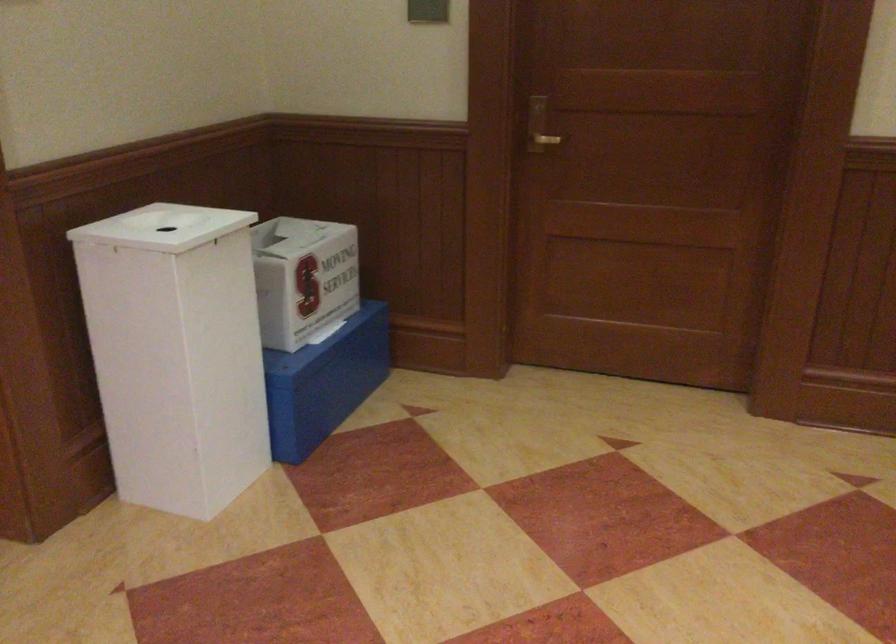
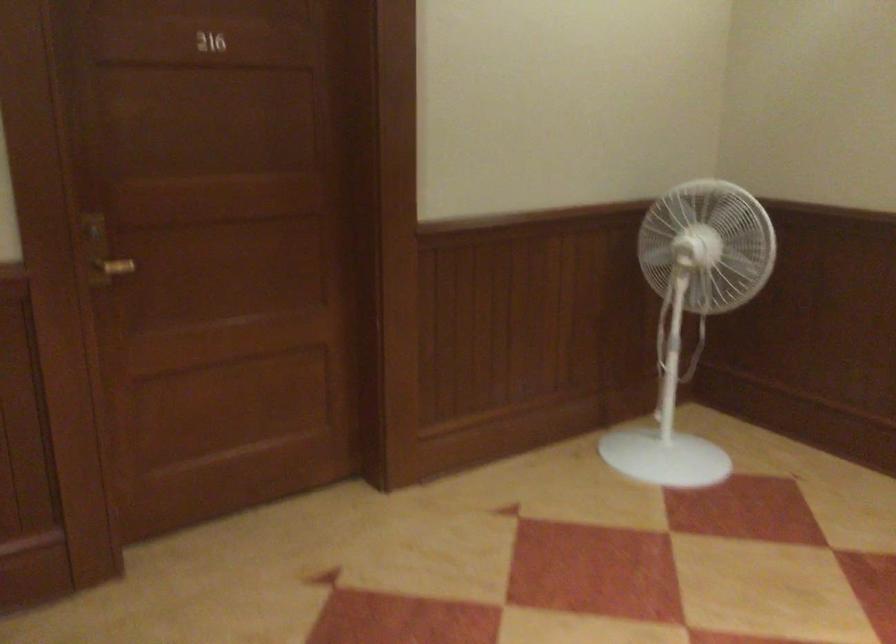
In the second image, find the point that corresponds to (533,122) in the first image.

(101, 252)